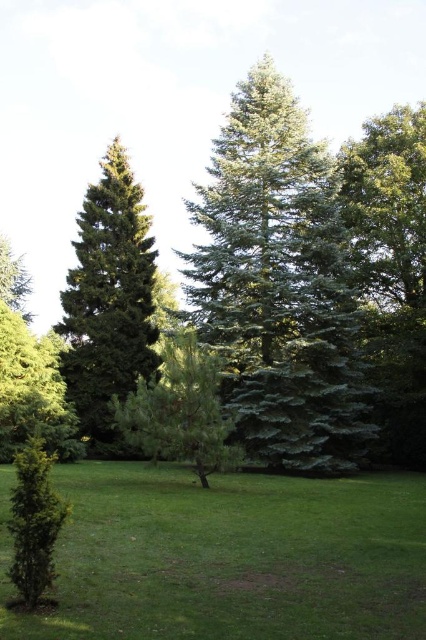
From the picture: Is green needle-like tree at left to the left of green matte tree at center from the viewer's perspective?

Indeed, green needle-like tree at left is positioned on the left side of green matte tree at center.

Between green needle-like tree at left and green matte tree at center, which one has less height?

Standing shorter between the two is green matte tree at center.

Identify the location of green needle-like tree at left. This screenshot has width=426, height=640. (x=109, y=301).

Is green needle-like tree at left to the right of green matte evergreen tree at lower left from the viewer's perspective?

Correct, you'll find green needle-like tree at left to the right of green matte evergreen tree at lower left.

Between green needle-like tree at left and green matte evergreen tree at lower left, which one has less height?

Standing shorter between the two is green matte evergreen tree at lower left.

What do you see at coordinates (109, 301) in the screenshot? This screenshot has height=640, width=426. I see `green needle-like tree at left` at bounding box center [109, 301].

Locate an element on the screen. green needle-like tree at left is located at coordinates (109, 301).

Is green grass at center wider than green needle-like at center?

Correct, the width of green grass at center exceeds that of green needle-like at center.

This screenshot has width=426, height=640. What do you see at coordinates (233, 557) in the screenshot?
I see `green grass at center` at bounding box center [233, 557].

This screenshot has height=640, width=426. I want to click on green grass at center, so click(x=233, y=557).